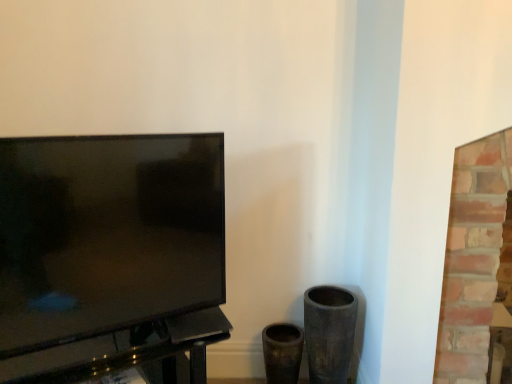
Question: Considering the positions of matte black tv at left and black glossy table at left in the image, is matte black tv at left wider or thinner than black glossy table at left?

Choices:
 (A) thin
 (B) wide

Answer: (A)

Question: Based on their sizes in the image, would you say matte black tv at left is bigger or smaller than black glossy table at left?

Choices:
 (A) big
 (B) small

Answer: (B)

Question: Based on their relative distances, which object is farther from the brick fireplace at right?

Choices:
 (A) black glossy table at left
 (B) matte black tv at left

Answer: (B)

Question: Which is nearer to the brick fireplace at right?

Choices:
 (A) matte black tv at left
 (B) black glossy table at left

Answer: (B)